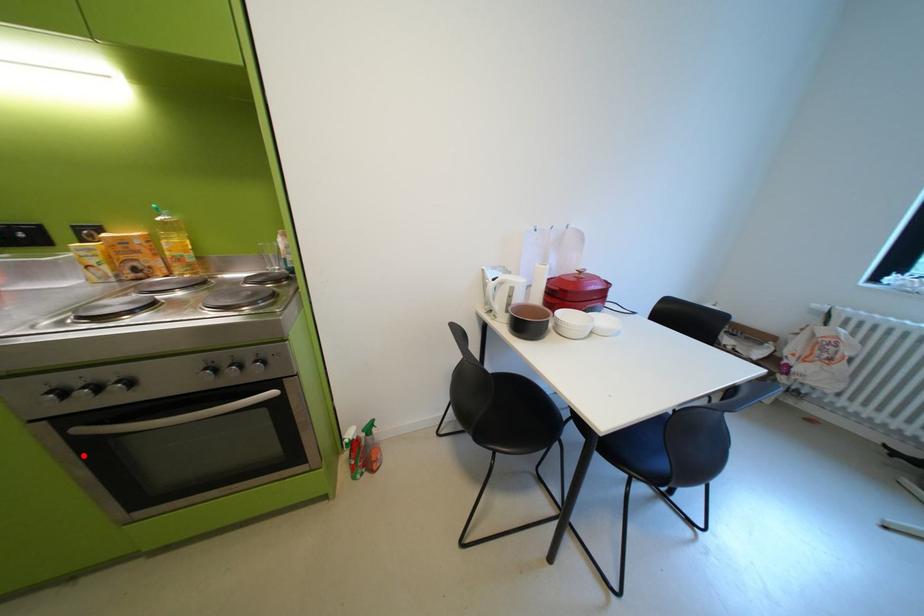
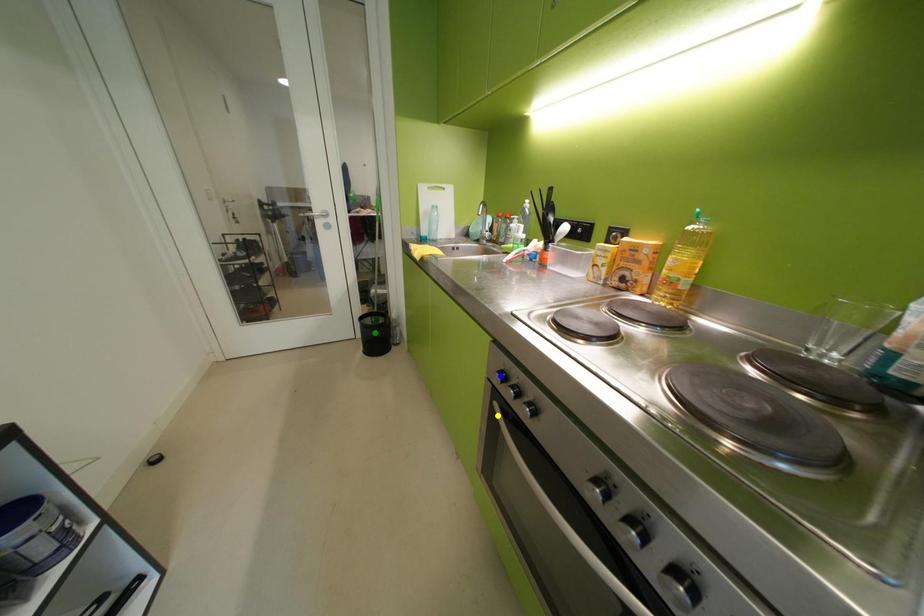
Question: I am providing you with two images of the same scene from different viewpoints. A red point is marked on the first image. You are given multiple points on the second image. Which point in image 2 represents the same 3d spot as the red point in image 1?

Choices:
 (A) green point
 (B) blue point
 (C) yellow point

Answer: (C)